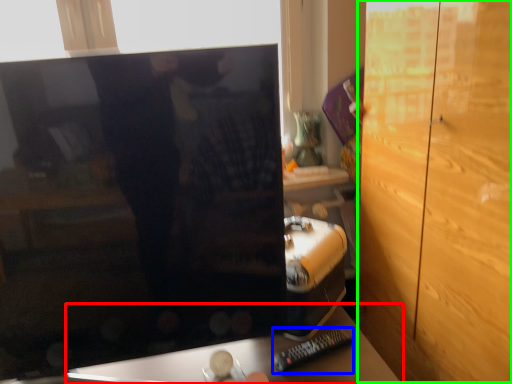
Question: Considering the real-world distances, which object is closest to furniture (highlighted by a red box)? remote (highlighted by a blue box) or dresser (highlighted by a green box).

Choices:
 (A) remote
 (B) dresser

Answer: (A)